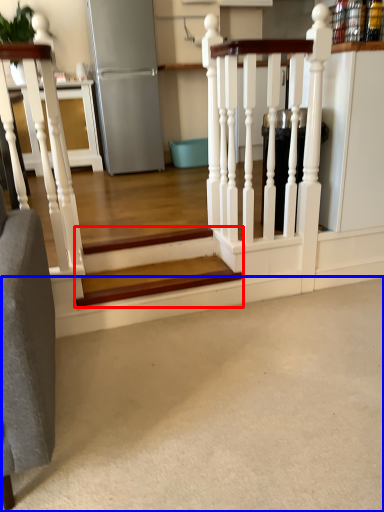
Question: Which object is closer to the camera taking this photo, stairs (highlighted by a red box) or concrete (highlighted by a blue box)?

Choices:
 (A) stairs
 (B) concrete

Answer: (B)